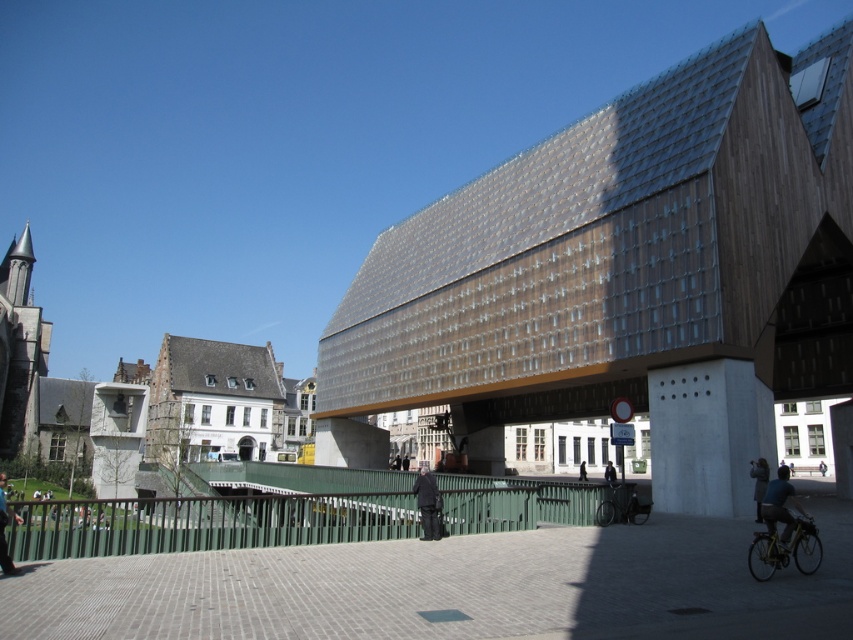
You are standing in the paved area near the green metal railing. You see the shiny metallic bicycle at lower right and the dark gray coat at center. Which object is nearer to you?

The shiny metallic bicycle at lower right is closer to the viewer than the dark gray coat at center.

You are a photographer trying to capture both the dark blue jeans at lower right and the dark gray suit at center in a single frame. Which of the two will appear smaller in your photo?

The dark blue jeans at lower right will appear smaller in the photo because it occupies less space than the dark gray suit at center.